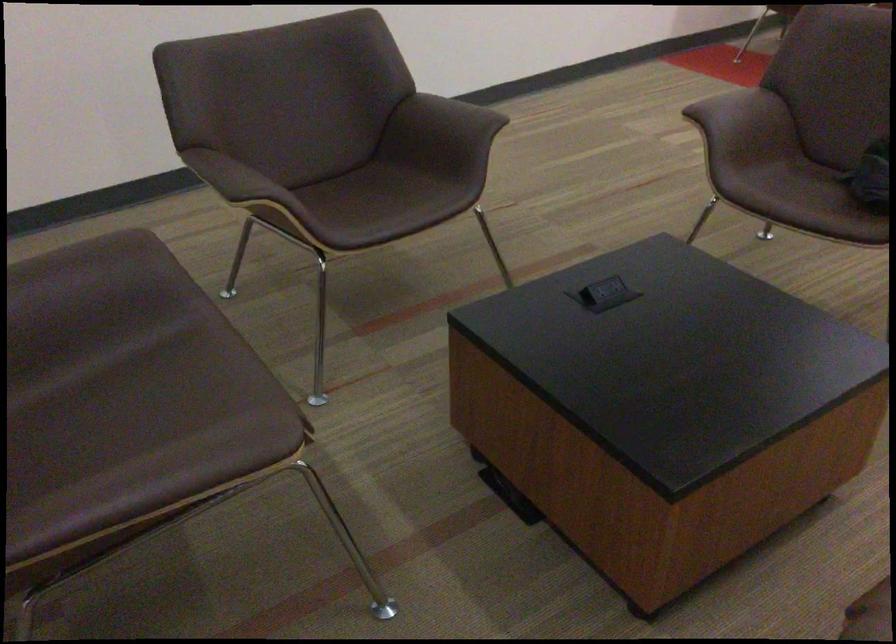
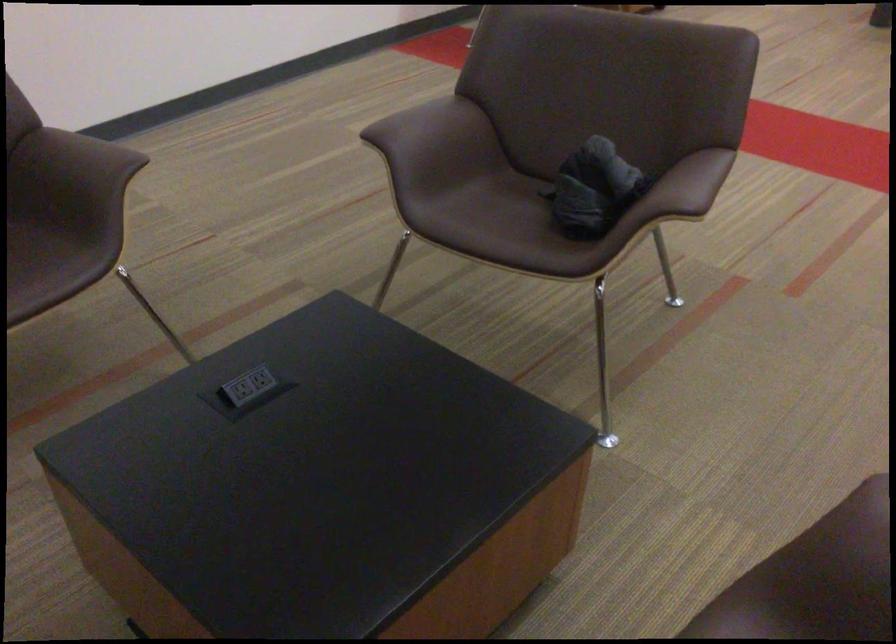
Question: The first image is from the beginning of the video and the second image is from the end. How did the camera likely rotate when shooting the video?

Choices:
 (A) Left
 (B) Right
 (C) Up
 (D) Down

Answer: (B)